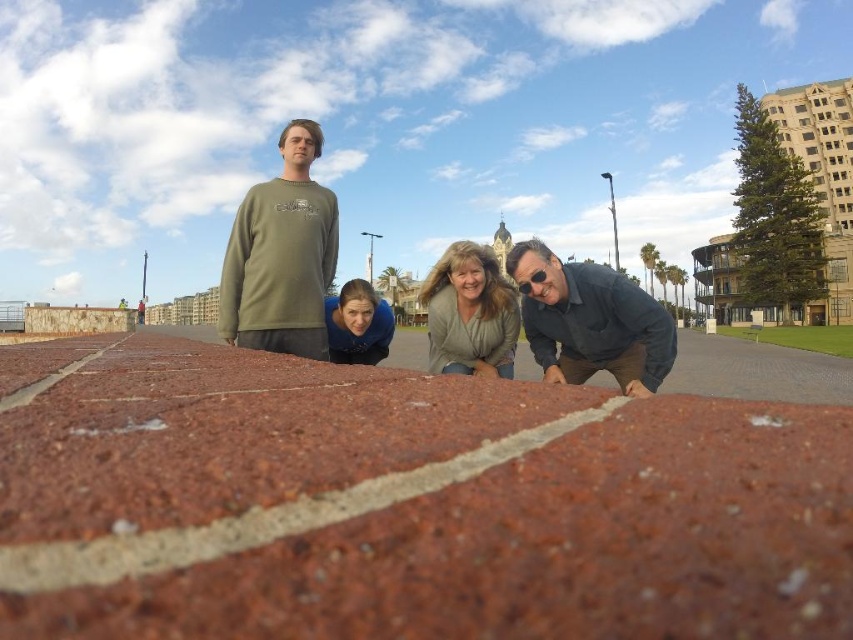
Which is more to the right, brick pavement at center or light brown sweater at center?

Positioned to the right is brick pavement at center.

Does brick pavement at center have a lesser width compared to light brown sweater at center?

No, brick pavement at center is not thinner than light brown sweater at center.

Measure the distance between brick pavement at center and camera.

brick pavement at center is 85.51 feet from camera.

You are a GUI agent. You are given a task and a screenshot of the screen. Output one action in this format:
    pyautogui.click(x=<x>, y=<y>)
    Task: Click on the brick pavement at center
    The height and width of the screenshot is (640, 853).
    Given the screenshot: What is the action you would take?
    pyautogui.click(x=757, y=371)

Who is positioned more to the right, green cotton shirt at center or brick pavement at center?

From the viewer's perspective, brick pavement at center appears more on the right side.

Is point (585, 301) more distant than point (152, 332)?

No, it is in front of (152, 332).

The height and width of the screenshot is (640, 853). Identify the location of green cotton shirt at center. (590, 321).

Is olive green sweatshirt at upper left thinner than dark gray shirt at lower right?

Yes, olive green sweatshirt at upper left is thinner than dark gray shirt at lower right.

Consider the image. Is olive green sweatshirt at upper left wider than dark gray shirt at lower right?

No, olive green sweatshirt at upper left is not wider than dark gray shirt at lower right.

The height and width of the screenshot is (640, 853). What do you see at coordinates (281, 256) in the screenshot? I see `olive green sweatshirt at upper left` at bounding box center [281, 256].

This screenshot has width=853, height=640. What are the coordinates of `olive green sweatshirt at upper left` in the screenshot? It's located at (281, 256).